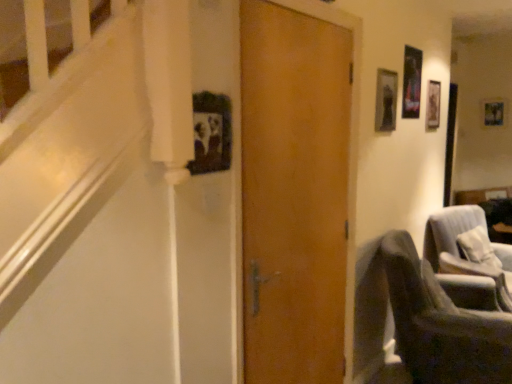
Identify the location of metallic silver picture frame at upper right, which appears as the second picture frame when viewed from the top. The width and height of the screenshot is (512, 384). (386, 100).

The width and height of the screenshot is (512, 384). What do you see at coordinates (294, 193) in the screenshot?
I see `wooden door at center` at bounding box center [294, 193].

Identify the location of wooden door at center. (294, 193).

The image size is (512, 384). Identify the location of dark gray fabric chair at lower right, acting as the second chair starting from the back. (441, 324).

This screenshot has height=384, width=512. What are the coordinates of `wooden photo frame at upper right, which is the 2th picture frame from front to back` in the screenshot? It's located at (493, 112).

Where is `door to the left of metallic silver picture frame at upper right, placed as the 2th picture frame when sorted from back to front`? Image resolution: width=512 pixels, height=384 pixels. door to the left of metallic silver picture frame at upper right, placed as the 2th picture frame when sorted from back to front is located at coordinates (294, 193).

From a real-world perspective, is wooden door at center physically below metallic silver picture frame at upper right, which appears as the second picture frame when viewed from the top?

Yes, from a real-world perspective, wooden door at center is under metallic silver picture frame at upper right, which appears as the second picture frame when viewed from the top.

Is wooden door at center not within metallic silver picture frame at upper right, arranged as the 1th picture frame when viewed from the front?

wooden door at center is positioned outside metallic silver picture frame at upper right, arranged as the 1th picture frame when viewed from the front.

Does wooden door at center have a greater height compared to metallic silver picture frame at upper right, which is counted as the second picture frame, starting from the right?

Yes.

Considering the relative sizes of velvet gray armchair at lower right, which is the 2th chair from front to back, and wooden photo frame at upper right, the first picture frame when ordered from back to front, in the image provided, is velvet gray armchair at lower right, which is the 2th chair from front to back, wider than wooden photo frame at upper right, the first picture frame when ordered from back to front,?

Correct, the width of velvet gray armchair at lower right, which is the 2th chair from front to back, exceeds that of wooden photo frame at upper right, the first picture frame when ordered from back to front.

From a real-world perspective, is velvet gray armchair at lower right, the 1th chair positioned from the back, positioned over wooden photo frame at upper right, the first picture frame when ordered from back to front, based on gravity?

Actually, velvet gray armchair at lower right, the 1th chair positioned from the back, is physically below wooden photo frame at upper right, the first picture frame when ordered from back to front, in the real world.

Is velvet gray armchair at lower right, the 1th chair positioned from the back, touching wooden photo frame at upper right, placed as the 1th picture frame when sorted from top to bottom?

velvet gray armchair at lower right, the 1th chair positioned from the back, and wooden photo frame at upper right, placed as the 1th picture frame when sorted from top to bottom, are not in contact.

Would you say dark gray fabric chair at lower right, which ranks as the 1th chair in front-to-back order, is outside wooden photo frame at upper right, the first picture frame from the right?

That's correct, dark gray fabric chair at lower right, which ranks as the 1th chair in front-to-back order, is outside of wooden photo frame at upper right, the first picture frame from the right.

Which object is further away from the camera taking this photo, dark gray fabric chair at lower right, acting as the second chair starting from the back, or wooden photo frame at upper right, placed as the 1th picture frame when sorted from top to bottom?

wooden photo frame at upper right, placed as the 1th picture frame when sorted from top to bottom, is behind.

Which is less distant, (407,243) or (489,101)?

Point (407,243)

Could you tell me if dark gray fabric chair at lower right, acting as the second chair starting from the back, is facing wooden photo frame at upper right, which is the 2th picture frame in bottom-to-top order?

No.

Would you consider wooden photo frame at upper right, marked as the 2th picture frame in a left-to-right arrangement, to be distant from wooden door at center?

Indeed, wooden photo frame at upper right, marked as the 2th picture frame in a left-to-right arrangement, is not near wooden door at center.

Can you confirm if wooden photo frame at upper right, the first picture frame when ordered from back to front, is thinner than wooden door at center?

Correct, the width of wooden photo frame at upper right, the first picture frame when ordered from back to front, is less than that of wooden door at center.

Consider the image. Considering the relative sizes of wooden photo frame at upper right, marked as the 2th picture frame in a left-to-right arrangement, and wooden door at center in the image provided, is wooden photo frame at upper right, marked as the 2th picture frame in a left-to-right arrangement, taller than wooden door at center?

In fact, wooden photo frame at upper right, marked as the 2th picture frame in a left-to-right arrangement, may be shorter than wooden door at center.

Who is bigger, wooden photo frame at upper right, marked as the 2th picture frame in a left-to-right arrangement, or wooden door at center?

wooden door at center is bigger.

Could you tell me if metallic silver picture frame at upper right, arranged as the 1th picture frame when viewed from the front, is facing velvet gray armchair at lower right, which is the 2th chair from front to back?

No, metallic silver picture frame at upper right, arranged as the 1th picture frame when viewed from the front, is not aimed at velvet gray armchair at lower right, which is the 2th chair from front to back.

From the picture: Considering the sizes of objects metallic silver picture frame at upper right, placed as the 2th picture frame when sorted from back to front, and velvet gray armchair at lower right, the 1th chair positioned from the back, in the image provided, who is taller, metallic silver picture frame at upper right, placed as the 2th picture frame when sorted from back to front, or velvet gray armchair at lower right, the 1th chair positioned from the back,?

With more height is velvet gray armchair at lower right, the 1th chair positioned from the back.

Can you tell me how much metallic silver picture frame at upper right, the 1th picture frame positioned from the left, and velvet gray armchair at lower right, which is the 2th chair from front to back, differ in facing direction?

17.8 degrees separate the facing orientations of metallic silver picture frame at upper right, the 1th picture frame positioned from the left, and velvet gray armchair at lower right, which is the 2th chair from front to back.

Which is behind, velvet gray armchair at lower right, the 1th chair positioned from the back, or wooden door at center?

velvet gray armchair at lower right, the 1th chair positioned from the back, is more distant.

From a real-world perspective, is velvet gray armchair at lower right, which is the 2th chair from front to back, physically above wooden door at center?

No, from a real-world perspective, velvet gray armchair at lower right, which is the 2th chair from front to back, is not above wooden door at center.

Identify the location of door that appears above the velvet gray armchair at lower right, the 1th chair positioned from the back (from a real-world perspective). (294, 193).

Is velvet gray armchair at lower right, which is the 2th chair from front to back, not near wooden door at center?

Absolutely, velvet gray armchair at lower right, which is the 2th chair from front to back, is distant from wooden door at center.

Consider the image. From the image's perspective, is dark gray fabric chair at lower right, which ranks as the 1th chair in front-to-back order, located above or below metallic silver picture frame at upper right, arranged as the 1th picture frame when viewed from the front?

From the image's perspective, dark gray fabric chair at lower right, which ranks as the 1th chair in front-to-back order, appears below metallic silver picture frame at upper right, arranged as the 1th picture frame when viewed from the front.

Is dark gray fabric chair at lower right, acting as the second chair starting from the back, positioned with its back to metallic silver picture frame at upper right, which appears as the second picture frame when viewed from the top?

No, metallic silver picture frame at upper right, which appears as the second picture frame when viewed from the top, is not at the back of dark gray fabric chair at lower right, acting as the second chair starting from the back.

Find the location of a particular element. This screenshot has width=512, height=384. picture frame that is the 1st one when counting rightward from the wooden door at center is located at coordinates (386, 100).

Find the location of `the 2nd chair positioned below the wooden photo frame at upper right, placed as the 1th picture frame when sorted from top to bottom (from a real-world perspective)`. the 2nd chair positioned below the wooden photo frame at upper right, placed as the 1th picture frame when sorted from top to bottom (from a real-world perspective) is located at coordinates (466, 261).

Estimate the real-world distances between objects in this image. Which object is further from wooden photo frame at upper right, placed as the 1th picture frame when sorted from top to bottom, metallic silver picture frame at upper right, which is counted as the second picture frame, starting from the right, or wooden door at center?

wooden door at center is positioned further to the anchor wooden photo frame at upper right, placed as the 1th picture frame when sorted from top to bottom.

Looking at the image, which one is located closer to metallic silver picture frame at upper right, which appears as the second picture frame when viewed from the top, wooden door at center or dark gray fabric chair at lower right, which ranks as the 1th chair in front-to-back order?

wooden door at center is closer to metallic silver picture frame at upper right, which appears as the second picture frame when viewed from the top.

Based on the photo, which object lies nearer to the anchor point dark gray fabric chair at lower right, acting as the second chair starting from the back, wooden door at center or velvet gray armchair at lower right, the 1th chair positioned from the back?

Among the two, velvet gray armchair at lower right, the 1th chair positioned from the back, is located nearer to dark gray fabric chair at lower right, acting as the second chair starting from the back.

From the image, which object appears to be nearer to velvet gray armchair at lower right, the 1th chair positioned from the back, wooden door at center or dark gray fabric chair at lower right, which ranks as the 1th chair in front-to-back order?

Among the two, dark gray fabric chair at lower right, which ranks as the 1th chair in front-to-back order, is located nearer to velvet gray armchair at lower right, the 1th chair positioned from the back.

Which object lies further to the anchor point velvet gray armchair at lower right, which is the 2th chair from front to back, wooden photo frame at upper right, which is the 2th picture frame from front to back, or wooden door at center?

The object further to velvet gray armchair at lower right, which is the 2th chair from front to back, is wooden photo frame at upper right, which is the 2th picture frame from front to back.

Estimate the real-world distances between objects in this image. Which object is closer to metallic silver picture frame at upper right, which appears as the second picture frame when viewed from the top, wooden photo frame at upper right, which is the 2th picture frame in bottom-to-top order, or wooden door at center?

wooden door at center is positioned closer to the anchor metallic silver picture frame at upper right, which appears as the second picture frame when viewed from the top.

From the picture: Based on their spatial positions, is velvet gray armchair at lower right, the 1th chair positioned from the back, or metallic silver picture frame at upper right, the 1th picture frame positioned from the left, closer to wooden photo frame at upper right, placed as the 1th picture frame when sorted from top to bottom?

Among the two, velvet gray armchair at lower right, the 1th chair positioned from the back, is located nearer to wooden photo frame at upper right, placed as the 1th picture frame when sorted from top to bottom.

When comparing their distances from dark gray fabric chair at lower right, acting as the second chair starting from the back, does wooden photo frame at upper right, placed as the 1th picture frame when sorted from top to bottom, or metallic silver picture frame at upper right, which is counted as the 1th picture frame, starting from the bottom, seem further?

Based on the image, wooden photo frame at upper right, placed as the 1th picture frame when sorted from top to bottom, appears to be further to dark gray fabric chair at lower right, acting as the second chair starting from the back.

The image size is (512, 384). I want to click on chair situated between wooden door at center and velvet gray armchair at lower right, the 1th chair positioned from the back, from left to right, so click(441, 324).

Identify the location of chair that lies between metallic silver picture frame at upper right, which is counted as the 1th picture frame, starting from the bottom, and dark gray fabric chair at lower right, which ranks as the 1th chair in front-to-back order, from top to bottom. The height and width of the screenshot is (384, 512). (466, 261).

Image resolution: width=512 pixels, height=384 pixels. I want to click on chair between metallic silver picture frame at upper right, which is counted as the 1th picture frame, starting from the bottom, and wooden photo frame at upper right, placed as the 1th picture frame when sorted from top to bottom, from front to back, so click(466, 261).

This screenshot has height=384, width=512. Identify the location of picture frame between dark gray fabric chair at lower right, which ranks as the 1th chair in front-to-back order, and wooden photo frame at upper right, marked as the 2th picture frame in a left-to-right arrangement, along the z-axis. (386, 100).